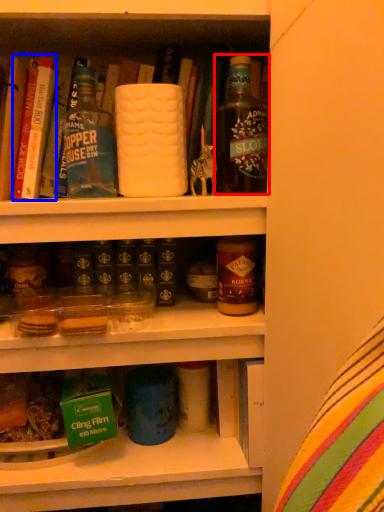
Question: Which point is further to the camera, bottle (highlighted by a red box) or book (highlighted by a blue box)?

Choices:
 (A) bottle
 (B) book

Answer: (B)